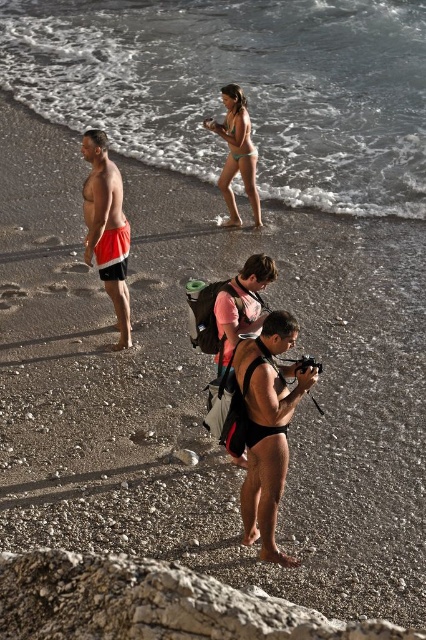
Who is higher up, orange fabric shorts at left or matte green bikini at center?

Positioned higher is matte green bikini at center.

Image resolution: width=426 pixels, height=640 pixels. What are the coordinates of `orange fabric shorts at left` in the screenshot? It's located at (106, 227).

Between point (235, 140) and point (235, 284), which one is positioned behind?

Positioned behind is point (235, 140).

Between matte green bikini at center and pink matte wetsuit at center, which one is positioned lower?

pink matte wetsuit at center

Locate an element on the screen. Image resolution: width=426 pixels, height=640 pixels. matte green bikini at center is located at coordinates (236, 152).

Is orange fabric shorts at left taller than pink matte wetsuit at center?

Yes.

What do you see at coordinates (106, 227) in the screenshot?
I see `orange fabric shorts at left` at bounding box center [106, 227].

Where is `orange fabric shorts at left`? orange fabric shorts at left is located at coordinates 106,227.